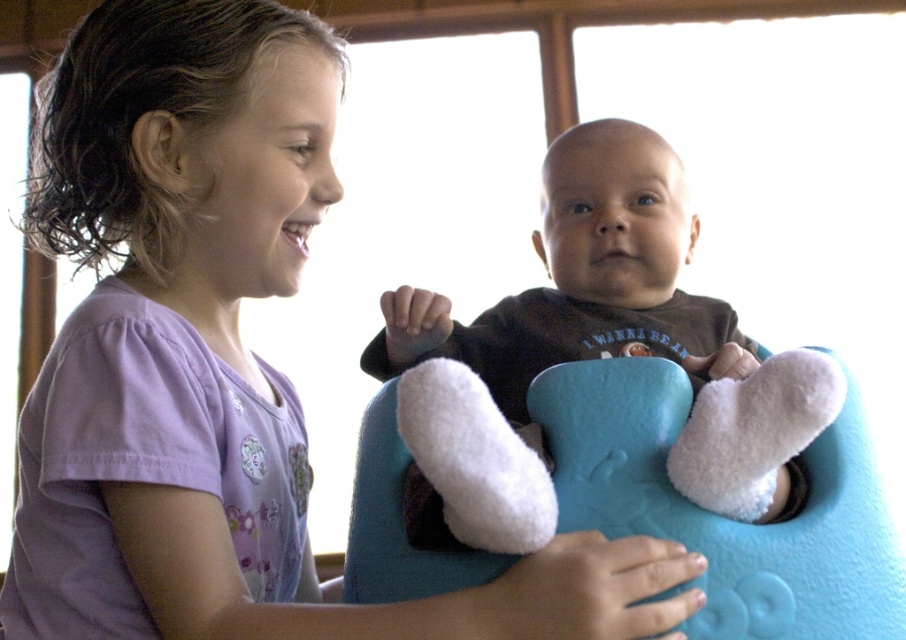
Which is below, soft brown baby at center or fuzzy blue bib at center?

fuzzy blue bib at center

Is soft brown baby at center bigger than fuzzy blue bib at center?

Yes, soft brown baby at center is bigger than fuzzy blue bib at center.

At what (x,y) coordinates should I click in order to perform the action: click on soft brown baby at center. Please return your answer as a coordinate pair (x, y). This screenshot has width=906, height=640. Looking at the image, I should click on (596, 353).

Find the location of `soft brown baby at center`. soft brown baby at center is located at coordinates (596, 353).